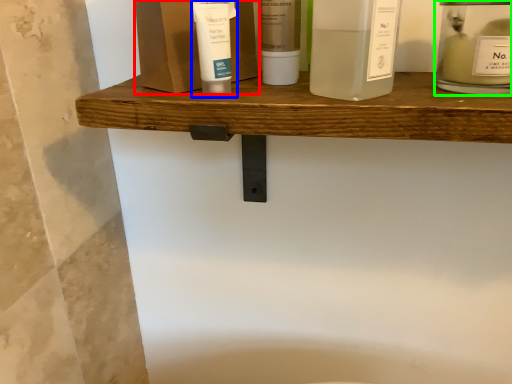
Question: Estimate the real-world distances between objects in this image. Which object is closer to product (highlighted by a red box), toiletry (highlighted by a blue box) or toiletry (highlighted by a green box)?

Choices:
 (A) toiletry
 (B) toiletry

Answer: (A)